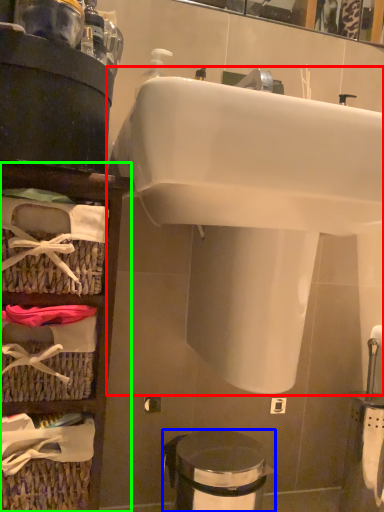
Question: Which is nearer to the sink (highlighted by a red box)? trash bin/can (highlighted by a blue box) or shelf (highlighted by a green box).

Choices:
 (A) trash bin/can
 (B) shelf

Answer: (B)